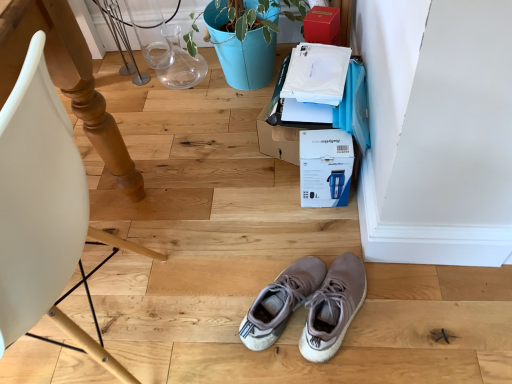
Question: Considering the relative positions of matte wood chair at left and light gray suede sneakers at center in the image provided, is matte wood chair at left to the left of light gray suede sneakers at center from the viewer's perspective?

Choices:
 (A) yes
 (B) no

Answer: (A)

Question: Does matte wood chair at left have a smaller size compared to light gray suede sneakers at center?

Choices:
 (A) no
 (B) yes

Answer: (A)

Question: Considering the relative sizes of matte wood chair at left and light gray suede sneakers at center in the image provided, is matte wood chair at left thinner than light gray suede sneakers at center?

Choices:
 (A) yes
 (B) no

Answer: (B)

Question: Is matte wood chair at left closer to the viewer compared to light gray suede sneakers at center?

Choices:
 (A) yes
 (B) no

Answer: (A)

Question: Can you confirm if matte wood chair at left is taller than light gray suede sneakers at center?

Choices:
 (A) no
 (B) yes

Answer: (B)

Question: Does matte wood chair at left lie behind light gray suede sneakers at center?

Choices:
 (A) no
 (B) yes

Answer: (A)

Question: Is blue cardboard box at center, which is the second cardboard box in top-to-bottom order, closer to the viewer compared to matte cardboard box at upper right, the first cardboard box positioned from the top?

Choices:
 (A) no
 (B) yes

Answer: (B)

Question: Can you confirm if blue cardboard box at center, which is the second cardboard box in top-to-bottom order, is bigger than matte cardboard box at upper right, the first cardboard box positioned from the top?

Choices:
 (A) no
 (B) yes

Answer: (B)

Question: Is blue cardboard box at center, which is counted as the 1th cardboard box, starting from the bottom, not inside matte cardboard box at upper right, which appears as the 2th cardboard box when ordered from the bottom?

Choices:
 (A) no
 (B) yes

Answer: (B)

Question: Does blue cardboard box at center, which is counted as the 1th cardboard box, starting from the bottom, lie behind matte cardboard box at upper right, which appears as the 2th cardboard box when ordered from the bottom?

Choices:
 (A) yes
 (B) no

Answer: (B)

Question: From a real-world perspective, does blue cardboard box at center, which is the second cardboard box in top-to-bottom order, stand above matte cardboard box at upper right, which appears as the 2th cardboard box when ordered from the bottom?

Choices:
 (A) no
 (B) yes

Answer: (A)

Question: Is blue cardboard box at center, which is the second cardboard box in top-to-bottom order, thinner than matte cardboard box at upper right, the first cardboard box positioned from the top?

Choices:
 (A) no
 (B) yes

Answer: (A)

Question: Is matte wood chair at left far away from matte cardboard box at upper right, which appears as the 2th cardboard box when ordered from the bottom?

Choices:
 (A) yes
 (B) no

Answer: (A)